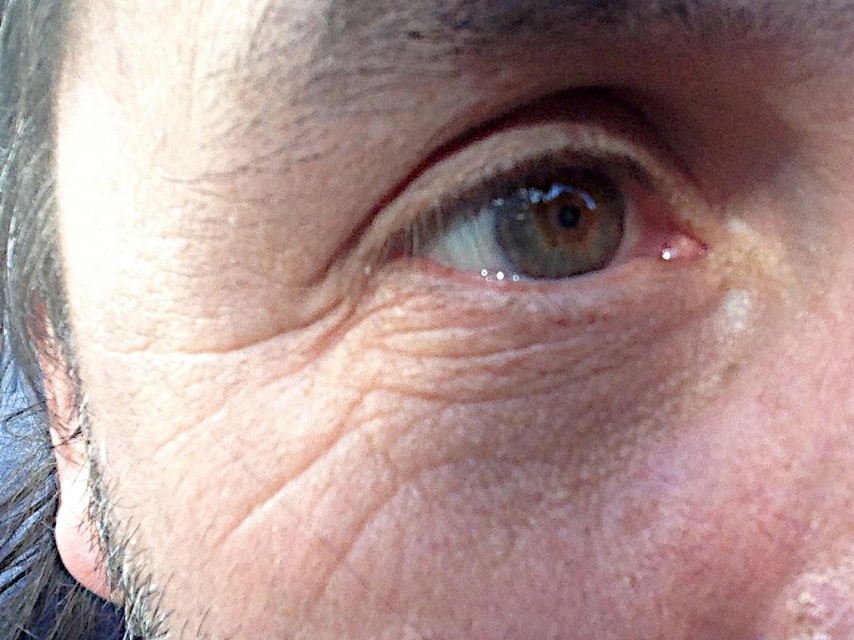
You are a skincare specialist examining this closeup of an eye area. You notice the green matte eye at center and the transparent skin at upper center. Which object is positioned more to the left in the image?

The green matte eye at center is positioned more to the left than the transparent skin at upper center.

You are a dermatologist examining a patient. You notice the green matte eye at center and the transparent skin at upper center. Which of these two features is closer to the viewer?

The green matte eye at center is closer to the viewer than the transparent skin at upper center because it is positioned in front of it.